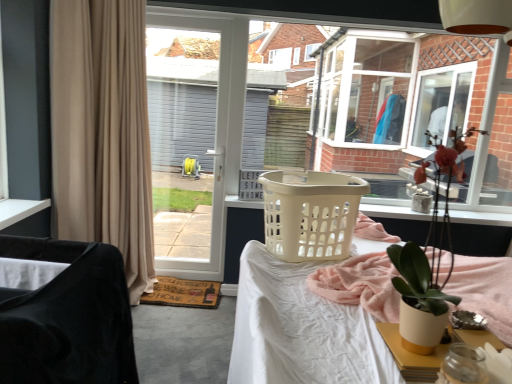
Question: Is velvet black chair at left beside white plastic desk at center?

Choices:
 (A) no
 (B) yes

Answer: (A)

Question: From a real-world perspective, is velvet black chair at left beneath white plastic desk at center?

Choices:
 (A) no
 (B) yes

Answer: (A)

Question: From a real-world perspective, is velvet black chair at left located higher than white plastic desk at center?

Choices:
 (A) yes
 (B) no

Answer: (A)

Question: Could you tell me if velvet black chair at left is facing white plastic desk at center?

Choices:
 (A) no
 (B) yes

Answer: (B)

Question: Is velvet black chair at left smaller than white plastic desk at center?

Choices:
 (A) no
 (B) yes

Answer: (B)

Question: Considering the relative sizes of velvet black chair at left and white plastic desk at center in the image provided, is velvet black chair at left thinner than white plastic desk at center?

Choices:
 (A) yes
 (B) no

Answer: (A)

Question: Is white plastic screen door at center thinner than transparent plastic laundry basket at center?

Choices:
 (A) yes
 (B) no

Answer: (B)

Question: Can you confirm if white plastic screen door at center is shorter than transparent plastic laundry basket at center?

Choices:
 (A) yes
 (B) no

Answer: (B)

Question: Is white plastic screen door at center directly adjacent to transparent plastic laundry basket at center?

Choices:
 (A) no
 (B) yes

Answer: (A)

Question: Can you confirm if white plastic screen door at center is bigger than transparent plastic laundry basket at center?

Choices:
 (A) no
 (B) yes

Answer: (A)

Question: Is white plastic screen door at center further to the viewer compared to transparent plastic laundry basket at center?

Choices:
 (A) no
 (B) yes

Answer: (A)

Question: From the image's perspective, is white plastic screen door at center located beneath transparent plastic laundry basket at center?

Choices:
 (A) no
 (B) yes

Answer: (B)

Question: Is velvet black chair at left thinner than beige plastic laundry basket at center?

Choices:
 (A) no
 (B) yes

Answer: (B)